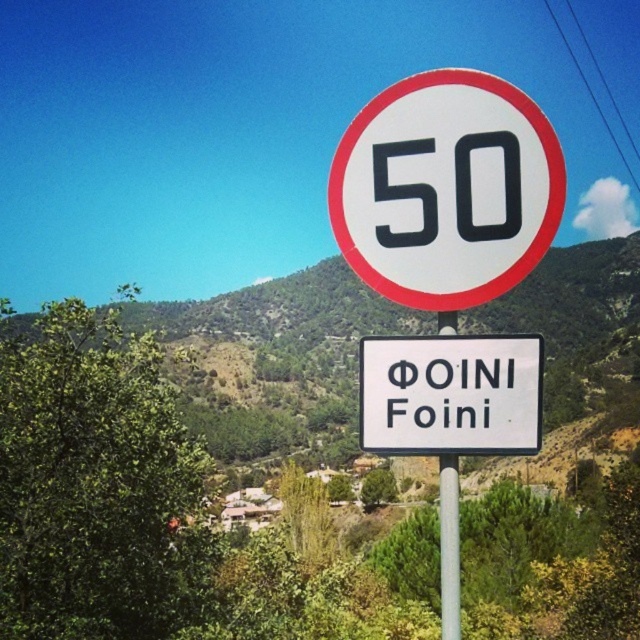
You are standing 3 meters away from a white plastic sign at center. Can you safely walk towards it without tripping over any obstacles?

The white plastic sign at center and viewer are 3.38 meters apart. Since you are standing 3 meters away, you are closer than the actual distance, so you can safely walk towards it without any obstacles in the way.

You are driving a truck that is 2 meters wide. You see a white plastic sign at center and a silver metallic pole at center ahead on the road. Can your truck pass between them without touching either?

The white plastic sign at center is thinner than the silver metallic pole at center, so the truck can pass between them as there is enough space.